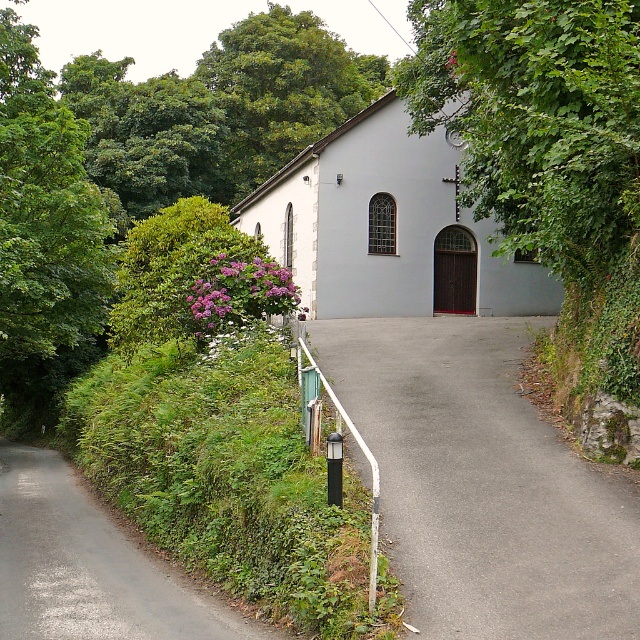
You are standing at the entrance of the chapel and want to walk to the green grassy driveway at lower left. There is a green leafy tree at left in your way. Can you walk directly to the driveway without going around the tree?

The green leafy tree at left is 9.01 meters away from the green grassy driveway at lower left. Since the tree is not blocking the direct path, you can walk directly to the driveway without going around the tree.

You are a gardener who needs to walk from the white metal rail at lower left to the gray asphalt driveway at center. Which direction should you move to reach the driveway?

The gray asphalt driveway at center is positioned on the right side of the white metal rail at lower left, so you should move to the right to reach the driveway.